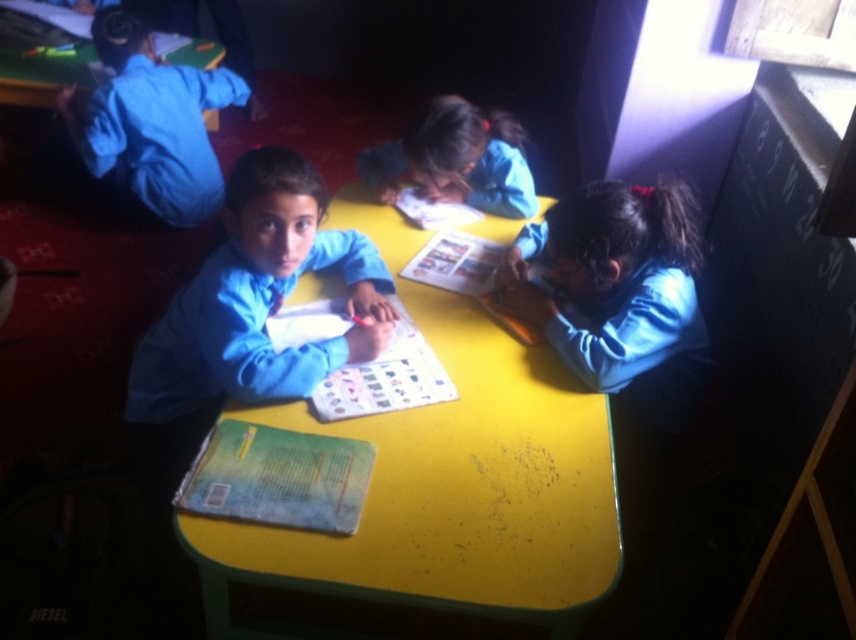
Question: Can you confirm if matte blue uniform at lower right is wider than blue uniform shirt at upper left?

Choices:
 (A) no
 (B) yes

Answer: (A)

Question: Is yellow matte table at center thinner than blue uniform shirt at upper left?

Choices:
 (A) no
 (B) yes

Answer: (A)

Question: Can you confirm if yellow matte table at center is bigger than blue uniform shirt at upper left?

Choices:
 (A) no
 (B) yes

Answer: (B)

Question: Which point is farther from the camera taking this photo?

Choices:
 (A) (391, 176)
 (B) (192, 218)
 (C) (572, 376)

Answer: (B)

Question: Among these objects, which one is farthest from the camera?

Choices:
 (A) blue uniform shirt at upper left
 (B) yellow matte table at center
 (C) matte blue uniform at lower right
 (D) blue fabric shirt at center

Answer: (A)

Question: Which point is closer to the camera taking this photo?

Choices:
 (A) (447, 145)
 (B) (203, 202)
 (C) (461, 403)
 (D) (651, 304)

Answer: (C)